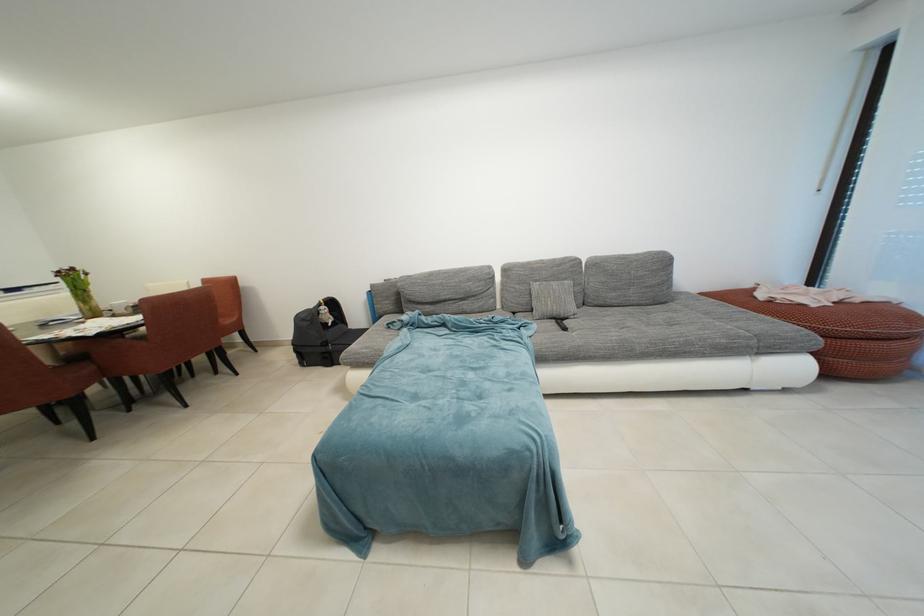
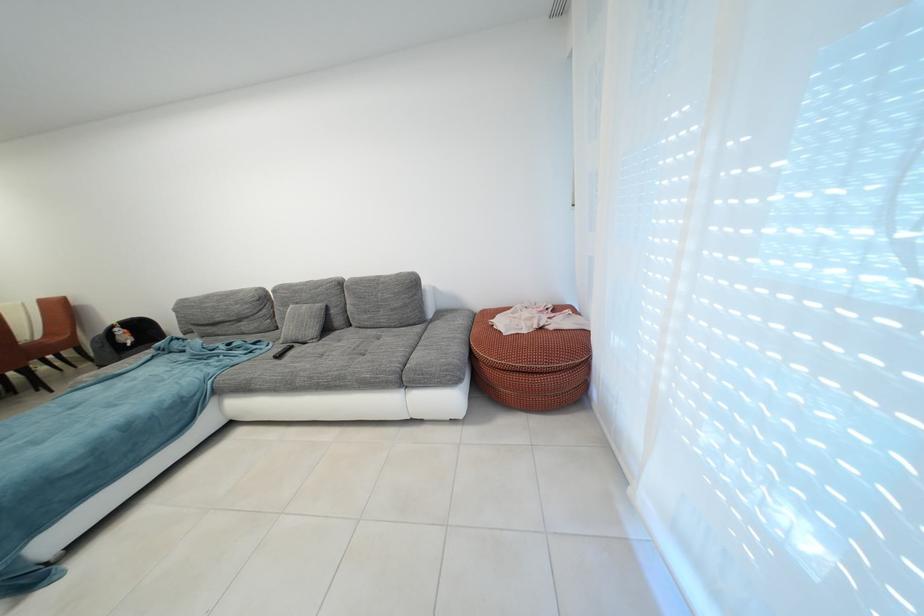
Locate, in the second image, the point that corresponds to point 573,333 in the first image.

(287, 361)